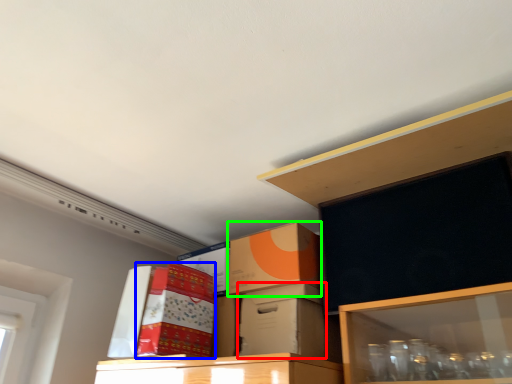
Question: Which object is the closest to the box (highlighted by a red box)? Choose among these: storage box (highlighted by a blue box) or box (highlighted by a green box).

Choices:
 (A) storage box
 (B) box

Answer: (B)